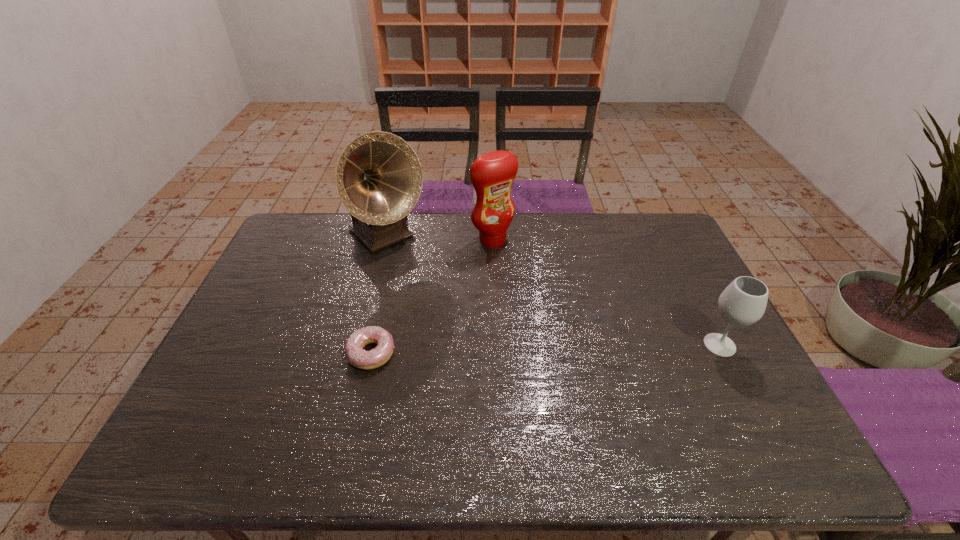
Identify the location of vacant space on the desktop that is between the doughnut and the third tallest object and is positioned on the label side of the second object from right to left. 597,348.

At what (x,y) coordinates should I click in order to perform the action: click on free space on the desktop that is between the doughnut and the wineglass and is positioned on the horn of the tallest object. Please return your answer as a coordinate pair (x, y). The width and height of the screenshot is (960, 540). Looking at the image, I should click on (503, 350).